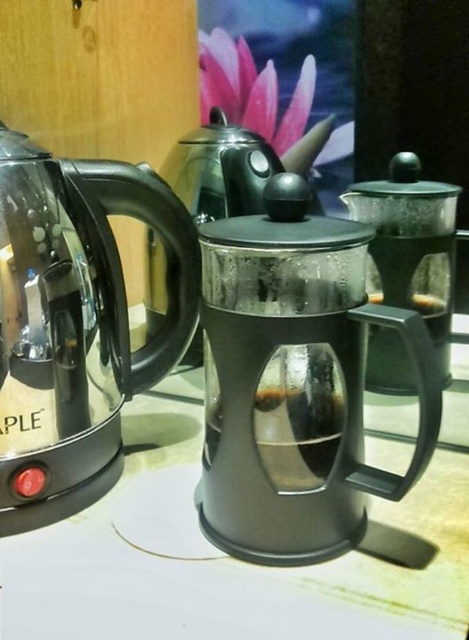
Question: Does black plastic coffee maker at center appear over transparent glass coffee press at center?

Choices:
 (A) no
 (B) yes

Answer: (A)

Question: Does black plastic coffee maker at center have a larger size compared to shiny black kettle at left?

Choices:
 (A) no
 (B) yes

Answer: (B)

Question: Which object appears closest to the camera in this image?

Choices:
 (A) transparent glass coffee press at center
 (B) shiny black kettle at left
 (C) black plastic coffee maker at center

Answer: (C)

Question: Does shiny black kettle at left appear on the right side of transparent glass coffee press at center?

Choices:
 (A) no
 (B) yes

Answer: (A)

Question: Which object appears farthest from the camera in this image?

Choices:
 (A) black plastic coffee maker at center
 (B) transparent glass coffee press at center

Answer: (B)

Question: Which object is closer to the camera taking this photo?

Choices:
 (A) black plastic coffee maker at center
 (B) shiny black kettle at left
 (C) transparent glass coffee press at center

Answer: (A)